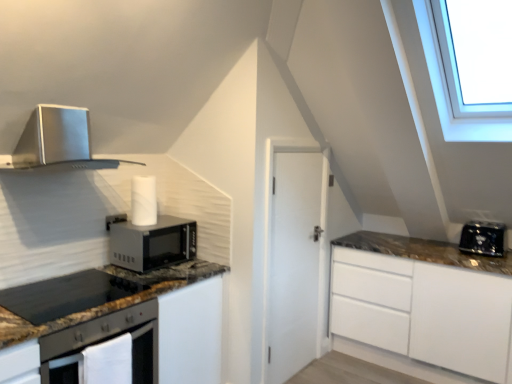
The width and height of the screenshot is (512, 384). Find the location of `free space above black granite countertop at lower left (from a real-world perspective)`. free space above black granite countertop at lower left (from a real-world perspective) is located at coordinates (76, 290).